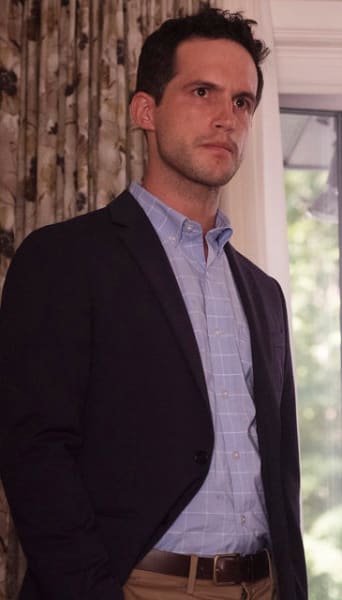
The height and width of the screenshot is (600, 342). In order to click on lamp in this screenshot , I will do `click(325, 209)`.